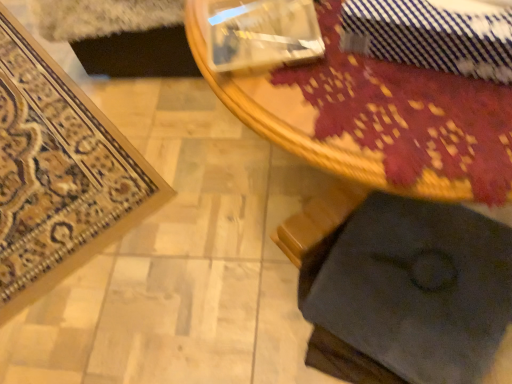
Question: Does blue striped tie at upper right contain wooden table at center?

Choices:
 (A) yes
 (B) no

Answer: (B)

Question: Can you confirm if blue striped tie at upper right is bigger than wooden table at center?

Choices:
 (A) no
 (B) yes

Answer: (A)

Question: Is blue striped tie at upper right positioned behind wooden table at center?

Choices:
 (A) no
 (B) yes

Answer: (B)

Question: From a real-world perspective, is blue striped tie at upper right physically above wooden table at center?

Choices:
 (A) yes
 (B) no

Answer: (A)

Question: Does blue striped tie at upper right have a smaller size compared to wooden table at center?

Choices:
 (A) yes
 (B) no

Answer: (A)

Question: Is carpeted mat at lower left inside or outside of blue striped tie at upper right?

Choices:
 (A) outside
 (B) inside

Answer: (A)

Question: Considering the relative positions of carpeted mat at lower left and blue striped tie at upper right in the image provided, is carpeted mat at lower left to the left or to the right of blue striped tie at upper right?

Choices:
 (A) left
 (B) right

Answer: (A)

Question: From a real-world perspective, relative to blue striped tie at upper right, is carpeted mat at lower left vertically above or below?

Choices:
 (A) above
 (B) below

Answer: (B)

Question: From the image's perspective, is carpeted mat at lower left located above or below blue striped tie at upper right?

Choices:
 (A) above
 (B) below

Answer: (A)

Question: Considering their positions, is blue striped tie at upper right located in front of or behind dark fabric cushion at lower right?

Choices:
 (A) front
 (B) behind

Answer: (A)

Question: In terms of width, does blue striped tie at upper right look wider or thinner when compared to dark fabric cushion at lower right?

Choices:
 (A) wide
 (B) thin

Answer: (B)

Question: In terms of size, does blue striped tie at upper right appear bigger or smaller than dark fabric cushion at lower right?

Choices:
 (A) big
 (B) small

Answer: (B)

Question: Does point pos(378,34) appear closer or farther from the camera than point pos(389,248)?

Choices:
 (A) farther
 (B) closer

Answer: (B)

Question: Does point (390, 117) appear closer or farther from the camera than point (284, 221)?

Choices:
 (A) farther
 (B) closer

Answer: (B)

Question: Visually, is wooden table at center positioned to the left or to the right of dark fabric cushion at lower right?

Choices:
 (A) left
 (B) right

Answer: (A)